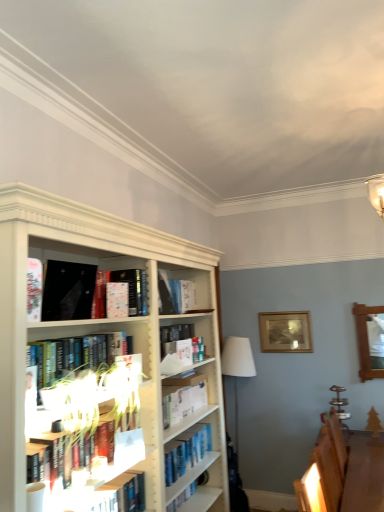
Question: From a real-world perspective, is wooden picture frame at upper center beneath matte white paperback book at center, which ranks as the second paperback book in front-to-back order?

Choices:
 (A) yes
 (B) no

Answer: (A)

Question: Considering the relative sizes of wooden picture frame at upper center and matte white paperback book at center, acting as the first paperback book starting from the back, in the image provided, is wooden picture frame at upper center smaller than matte white paperback book at center, acting as the first paperback book starting from the back,?

Choices:
 (A) no
 (B) yes

Answer: (A)

Question: Can matte white paperback book at center, which ranks as the second paperback book in front-to-back order, be found inside wooden picture frame at upper center?

Choices:
 (A) yes
 (B) no

Answer: (B)

Question: Can you confirm if wooden picture frame at upper center is wider than matte white paperback book at center, which ranks as the second paperback book in front-to-back order?

Choices:
 (A) no
 (B) yes

Answer: (B)

Question: Does wooden picture frame at upper center have a lesser height compared to matte white paperback book at center, which ranks as the second paperback book in front-to-back order?

Choices:
 (A) no
 (B) yes

Answer: (A)

Question: From a real-world perspective, is wooden picture frame at upper center located higher than matte white paperback book at center, which ranks as the second paperback book in front-to-back order?

Choices:
 (A) no
 (B) yes

Answer: (A)

Question: Is white fabric lampshade at center a part of matte black book at upper left, the second paperback book in the back-to-front sequence?

Choices:
 (A) yes
 (B) no

Answer: (B)

Question: Does matte black book at upper left, which is the first paperback book from front to back, have a larger size compared to white fabric lampshade at center?

Choices:
 (A) yes
 (B) no

Answer: (B)

Question: Can you confirm if matte black book at upper left, which is the first paperback book from front to back, is smaller than white fabric lampshade at center?

Choices:
 (A) yes
 (B) no

Answer: (A)

Question: Is matte black book at upper left, which is the first paperback book from front to back, facing away from white fabric lampshade at center?

Choices:
 (A) yes
 (B) no

Answer: (B)

Question: Is matte black book at upper left, which is the first paperback book from front to back, to the left of white fabric lampshade at center from the viewer's perspective?

Choices:
 (A) yes
 (B) no

Answer: (A)

Question: Is matte black book at upper left, the second paperback book in the back-to-front sequence, not close to white fabric lampshade at center?

Choices:
 (A) no
 (B) yes

Answer: (B)

Question: Is matte black book at upper left, which is the first paperback book from front to back, far away from matte white paperback book at center, acting as the first paperback book starting from the back?

Choices:
 (A) no
 (B) yes

Answer: (A)